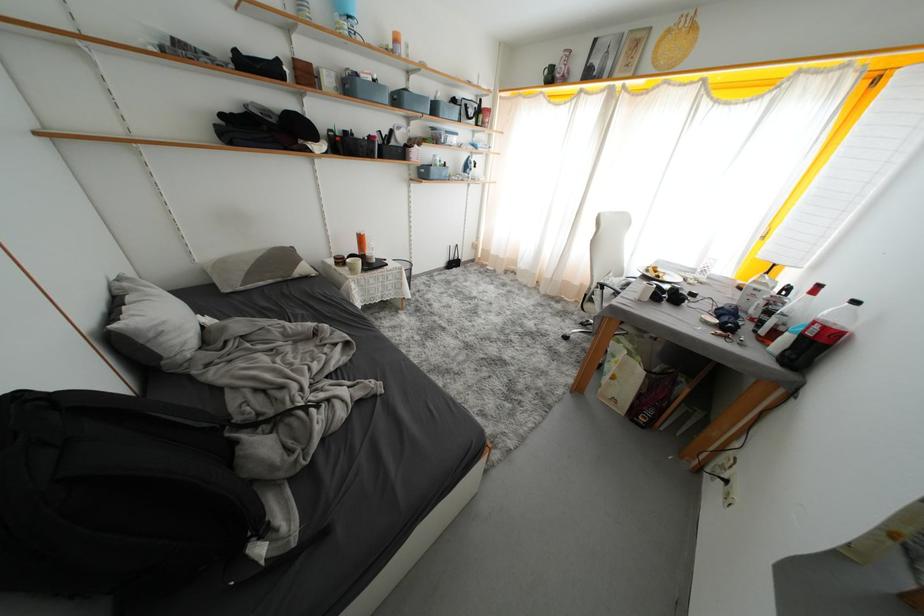
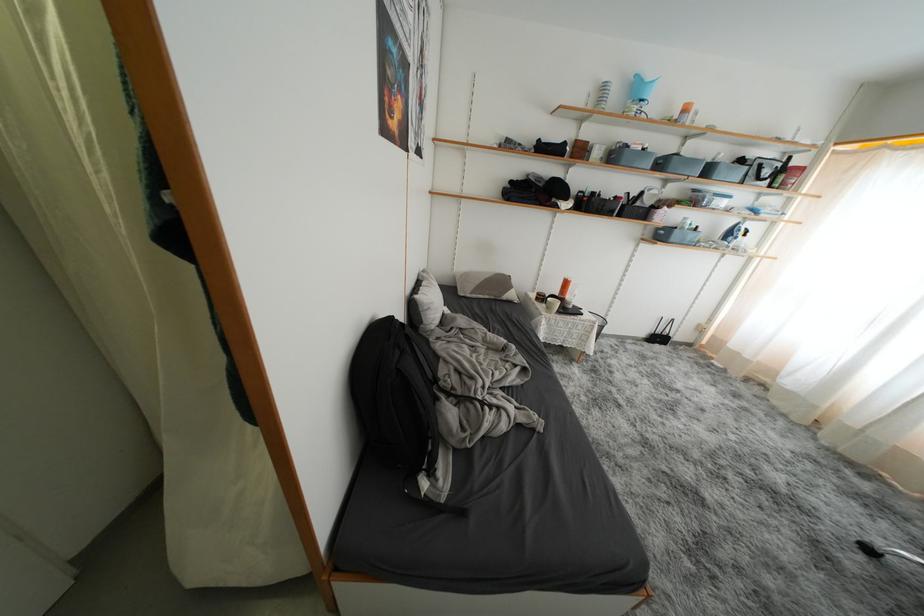
Locate, in the second image, the point that corresponds to (420,179) in the first image.

(654, 238)